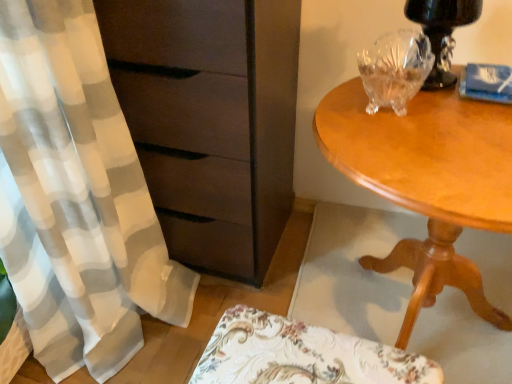
Question: Is matte brown chest of drawers at left outside light brown wood table at right?

Choices:
 (A) yes
 (B) no

Answer: (A)

Question: Is matte brown chest of drawers at left at the left side of light brown wood table at right?

Choices:
 (A) yes
 (B) no

Answer: (A)

Question: Is the surface of matte brown chest of drawers at left in direct contact with light brown wood table at right?

Choices:
 (A) yes
 (B) no

Answer: (B)

Question: Is matte brown chest of drawers at left at the right side of light brown wood table at right?

Choices:
 (A) yes
 (B) no

Answer: (B)

Question: Does matte brown chest of drawers at left have a smaller size compared to light brown wood table at right?

Choices:
 (A) yes
 (B) no

Answer: (B)

Question: From a real-world perspective, is matte brown chest of drawers at left on light brown wood table at right?

Choices:
 (A) yes
 (B) no

Answer: (A)

Question: Considering the relative sizes of floral fabric cushion at lower center and transparent crystal bowl at upper right in the image provided, is floral fabric cushion at lower center thinner than transparent crystal bowl at upper right?

Choices:
 (A) no
 (B) yes

Answer: (B)

Question: Are floral fabric cushion at lower center and transparent crystal bowl at upper right far apart?

Choices:
 (A) yes
 (B) no

Answer: (B)

Question: Does floral fabric cushion at lower center have a greater width compared to transparent crystal bowl at upper right?

Choices:
 (A) yes
 (B) no

Answer: (B)

Question: Considering the relative sizes of floral fabric cushion at lower center and transparent crystal bowl at upper right in the image provided, is floral fabric cushion at lower center bigger than transparent crystal bowl at upper right?

Choices:
 (A) yes
 (B) no

Answer: (A)

Question: From a real-world perspective, is floral fabric cushion at lower center beneath transparent crystal bowl at upper right?

Choices:
 (A) no
 (B) yes

Answer: (B)

Question: Is transparent crystal bowl at upper right at the back of floral fabric cushion at lower center?

Choices:
 (A) no
 (B) yes

Answer: (A)

Question: From a real-world perspective, is transparent crystal bowl at upper right below black glossy table lamp at upper right?

Choices:
 (A) yes
 (B) no

Answer: (A)